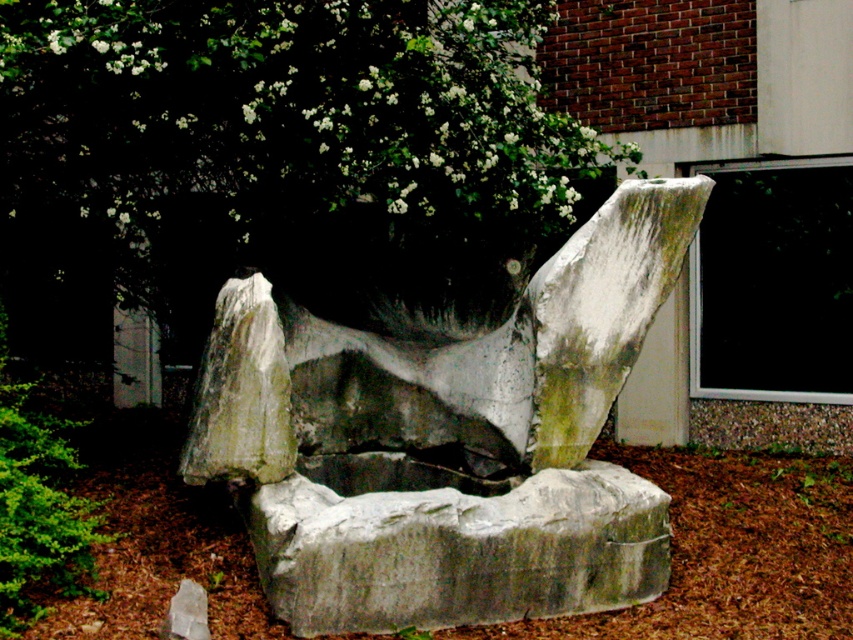
You are a landscape architect designing a garden path that needs to pass between the gray stone sculpture at center and the green leafy tree at upper center. Based on their widths, which object will require more space on the path?

The green leafy tree at upper center requires more space on the path since it is wider than the gray stone sculpture at center according to the description.

You are a gardener who needs to place a 30 inch wide decorative rock between the gray stone sculpture at center and the brown mulch at center. Is there enough space for it?

The distance between the gray stone sculpture at center and the brown mulch at center is 34.08 inches, so yes, the 30 inch wide decorative rock can fit between them since the available space is larger than the rock.